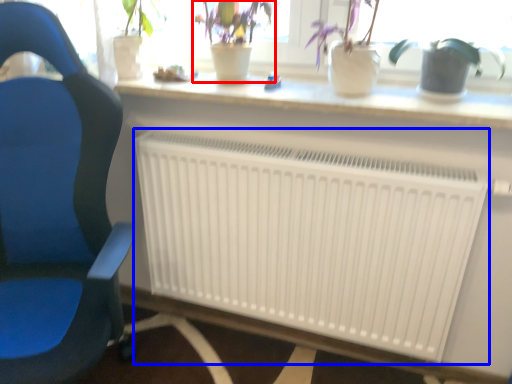
Question: Which point is further to the camera, houseplant (highlighted by a red box) or radiator (highlighted by a blue box)?

Choices:
 (A) houseplant
 (B) radiator

Answer: (A)